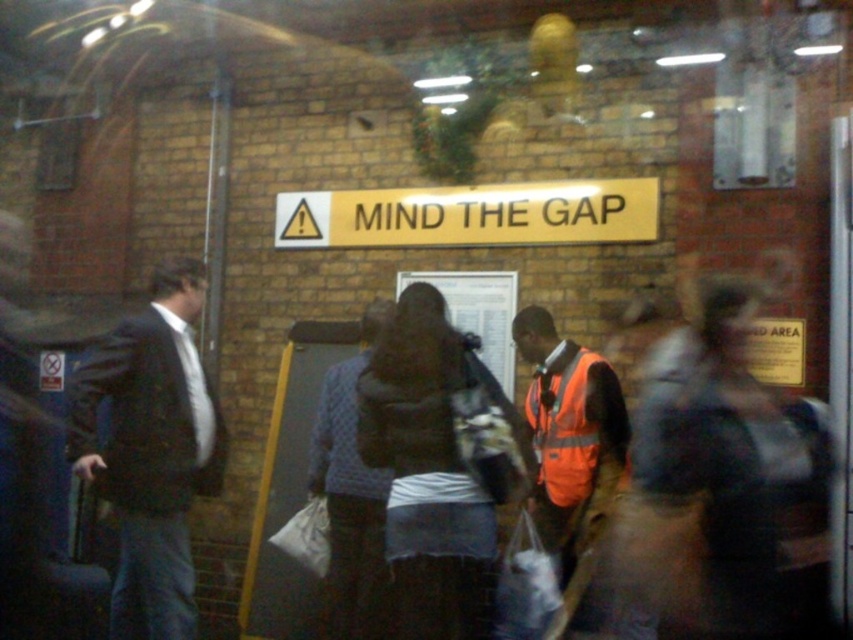
Between orange reflective vest at left and orange reflective safety vest at center, which one has less height?

orange reflective safety vest at center

Looking at this image, is orange reflective vest at left smaller than orange reflective safety vest at center?

Actually, orange reflective vest at left might be larger than orange reflective safety vest at center.

Is point (90, 477) positioned before point (527, 403)?

Yes, it is.

The height and width of the screenshot is (640, 853). What are the coordinates of `orange reflective vest at left` in the screenshot? It's located at (151, 451).

In the scene shown: Which is above, orange reflective vest at left or gold metallic sign at center?

gold metallic sign at center

Between point (108, 378) and point (389, 221), which one is positioned in front?

Point (108, 378) is more forward.

Locate an element on the screen. The width and height of the screenshot is (853, 640). orange reflective vest at left is located at coordinates (151, 451).

Can you confirm if gold metallic sign at center is positioned to the right of orange reflective safety vest at center?

Incorrect, gold metallic sign at center is not on the right side of orange reflective safety vest at center.

Does gold metallic sign at center have a lesser width compared to orange reflective safety vest at center?

No, gold metallic sign at center is not thinner than orange reflective safety vest at center.

Between point (376, 208) and point (567, 385), which one is positioned behind?

Positioned behind is point (376, 208).

Locate an element on the screen. gold metallic sign at center is located at coordinates (471, 214).